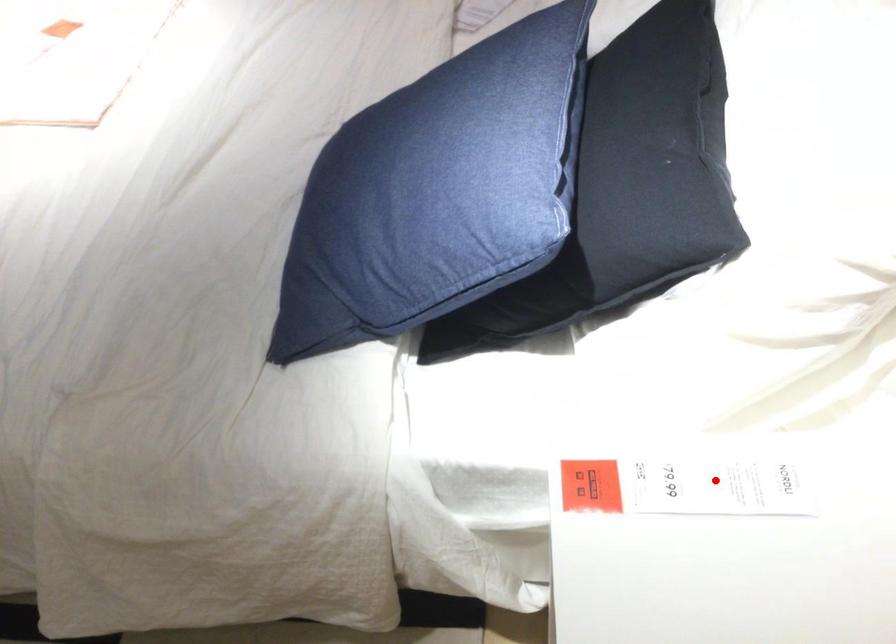
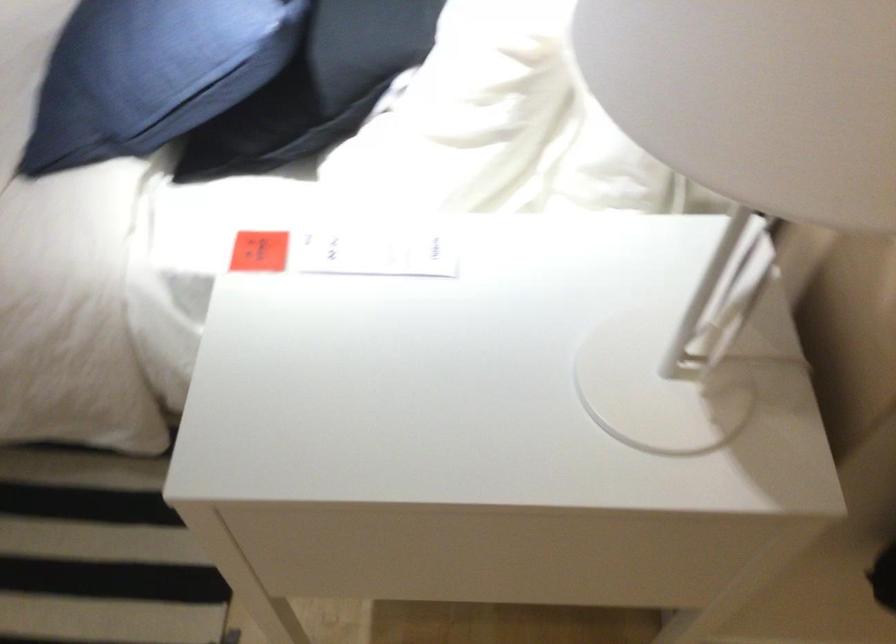
Locate, in the second image, the point that corresponds to the highlighted location in the first image.

(375, 252)